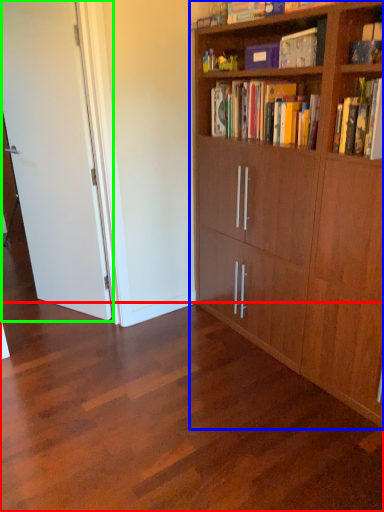
Question: Which is nearer to the plain (highlighted by a red box)? bookcase (highlighted by a blue box) or door (highlighted by a green box).

Choices:
 (A) bookcase
 (B) door

Answer: (A)